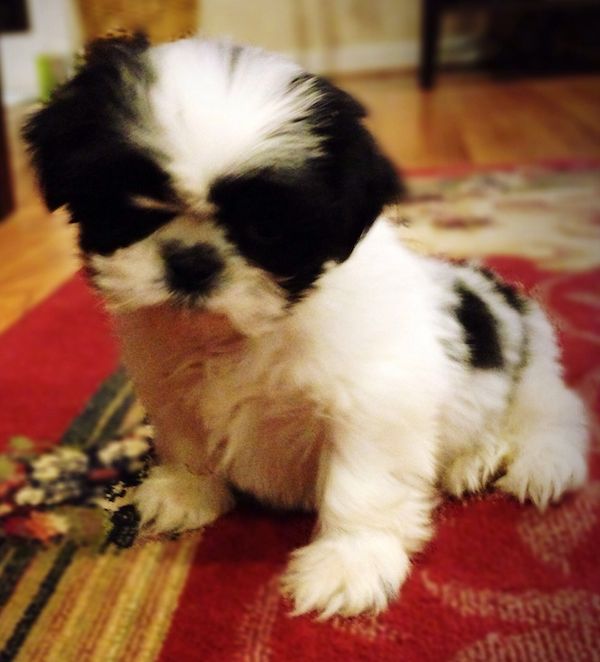
This screenshot has width=600, height=662. Identify the location of white chest. (267, 375).